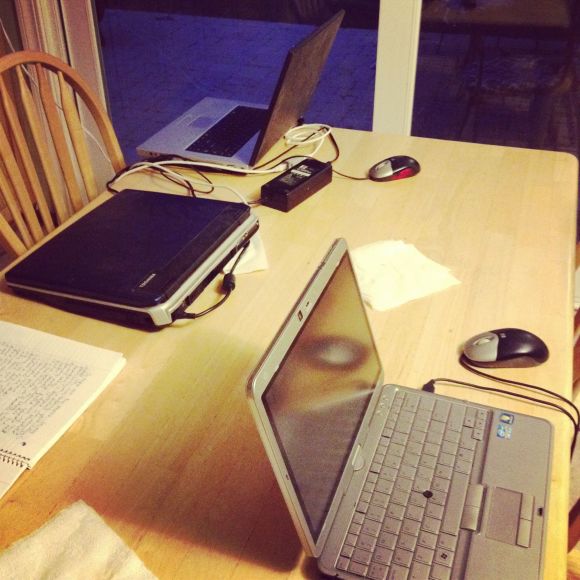
Where is `laptops`? laptops is located at coordinates (292, 79), (279, 343).